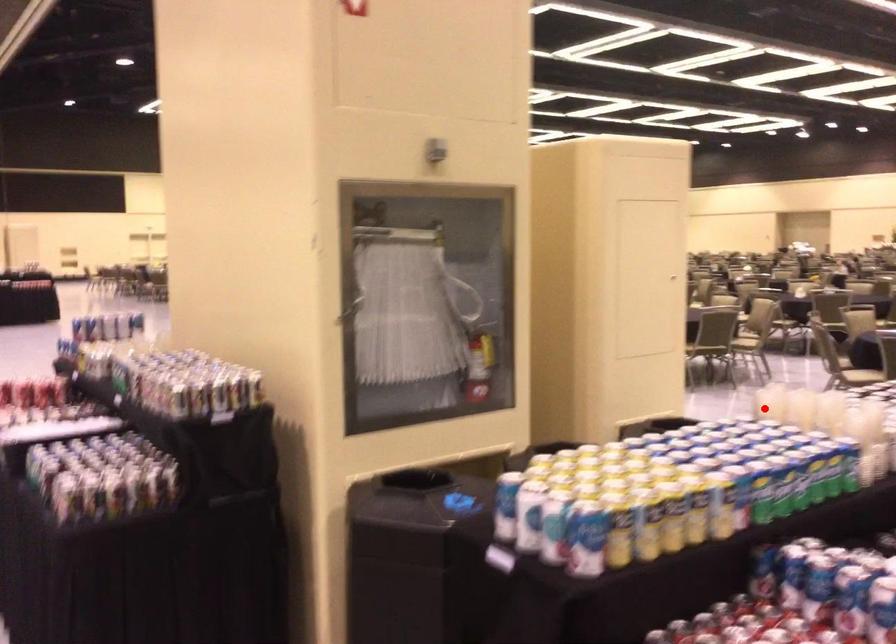
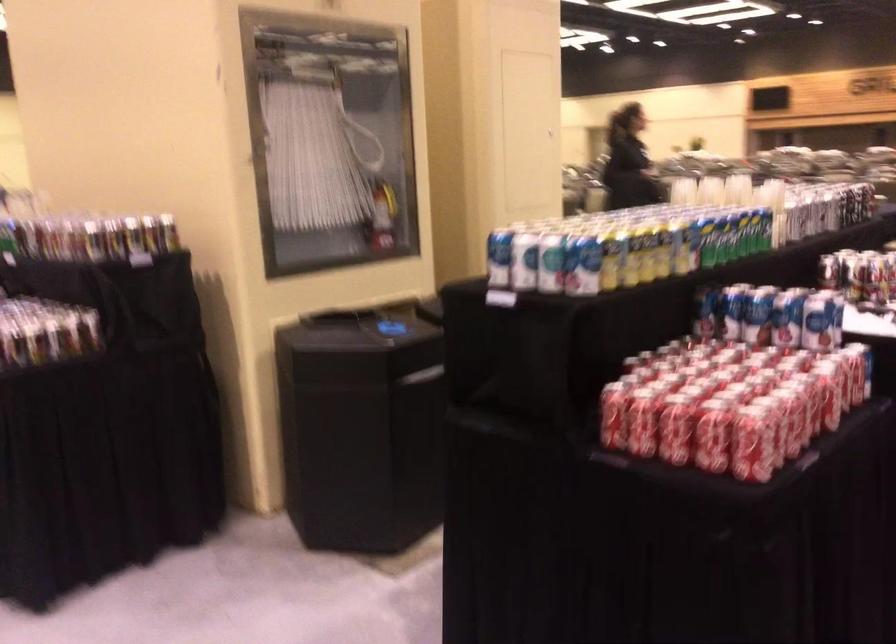
In the second image, find the point that corresponds to the highlighted location in the first image.

(683, 190)